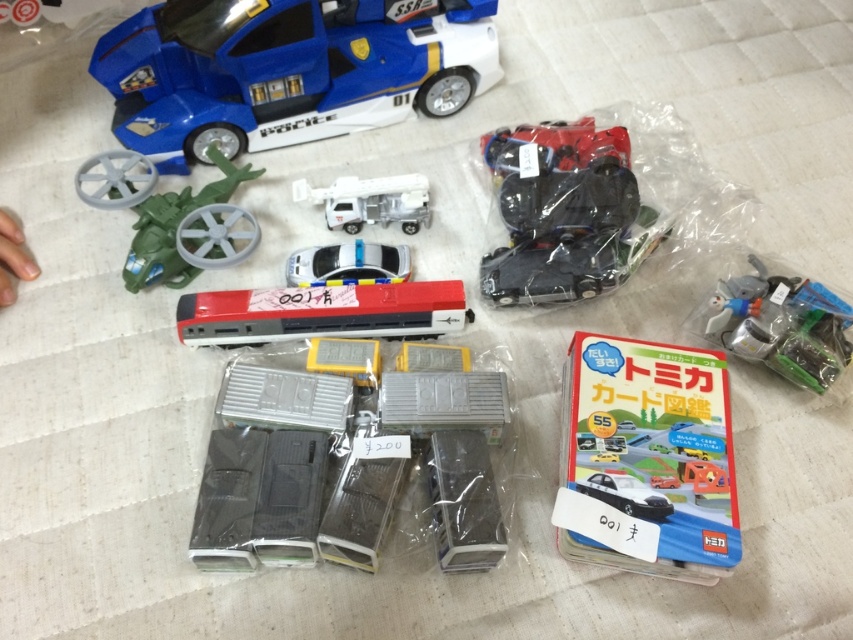
Question: Does green matte helicopter at upper left appear over matte black car at center?

Choices:
 (A) yes
 (B) no

Answer: (A)

Question: Which of the following is the closest to the observer?

Choices:
 (A) green matte helicopter at upper left
 (B) white plastic truck at center

Answer: (A)

Question: In this image, where is matte red train at center located relative to black plastic toy car at upper right?

Choices:
 (A) right
 (B) left

Answer: (B)

Question: Which of these objects is positioned farthest from the white glossy car at center?

Choices:
 (A) matte red car at upper right
 (B) matte red train at center
 (C) matte plastic book at center
 (D) white plastic truck at center

Answer: (C)

Question: Is metallic silver toy at right positioned behind green matte helicopter at upper left?

Choices:
 (A) no
 (B) yes

Answer: (A)

Question: Which object is closer to the camera taking this photo?

Choices:
 (A) matte plastic book at center
 (B) metallic silver toy at right
 (C) white glossy car at center

Answer: (A)